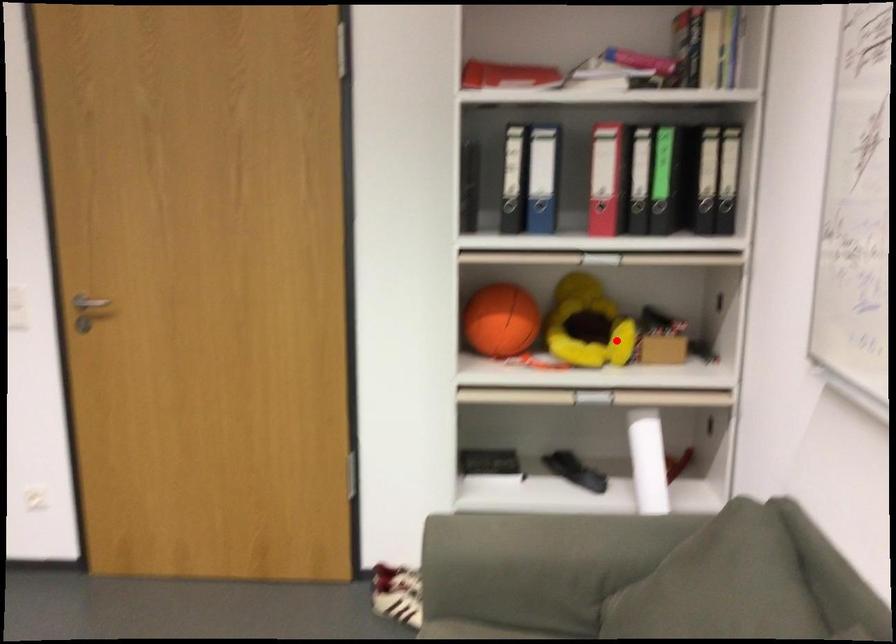
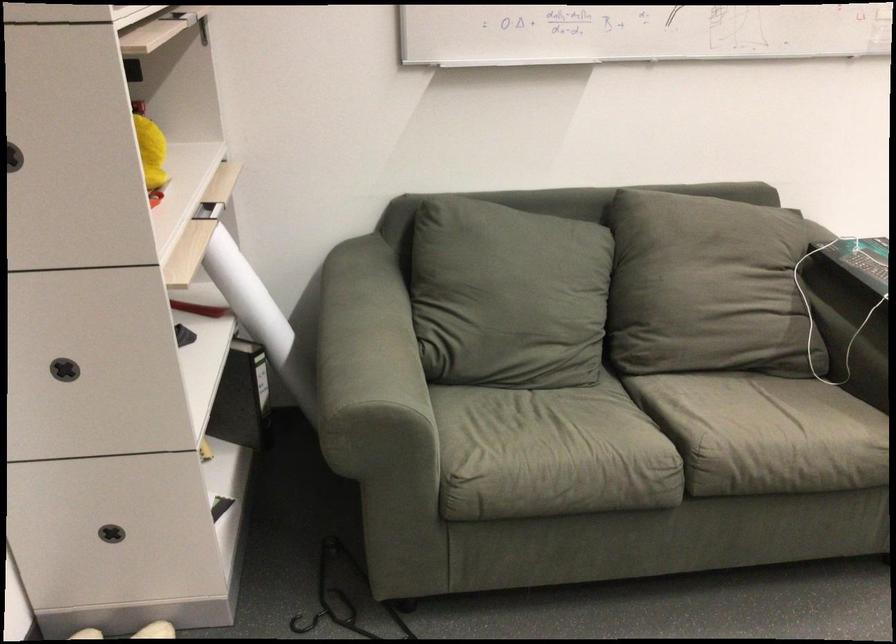
Locate, in the second image, the point that corresponds to the highlighted location in the first image.

(151, 152)